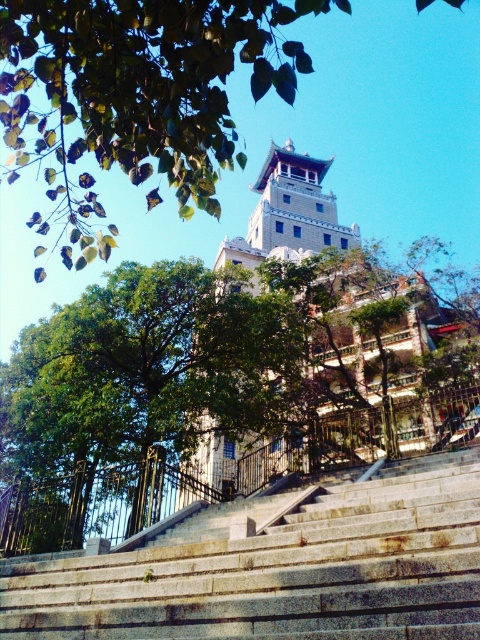
Question: Estimate the real-world distances between objects in this image. Which object is farther from the gray stone stairs at center?

Choices:
 (A) green leafy tree at center
 (B) green leafy tree at upper center

Answer: (B)

Question: Is green leafy tree at center positioned at the back of green leafy tree at upper center?

Choices:
 (A) no
 (B) yes

Answer: (B)

Question: Which is farther from the green leafy tree at upper center?

Choices:
 (A) gray stone stairs at center
 (B) green leafy tree at center

Answer: (A)

Question: Which object is positioned closest to the green leafy tree at center?

Choices:
 (A) green leafy tree at upper center
 (B) gray stone stairs at center

Answer: (B)

Question: Can you confirm if green leafy tree at center is wider than green leafy tree at upper center?

Choices:
 (A) yes
 (B) no

Answer: (B)

Question: Can you confirm if gray stone stairs at center is positioned below green leafy tree at upper center?

Choices:
 (A) no
 (B) yes

Answer: (B)